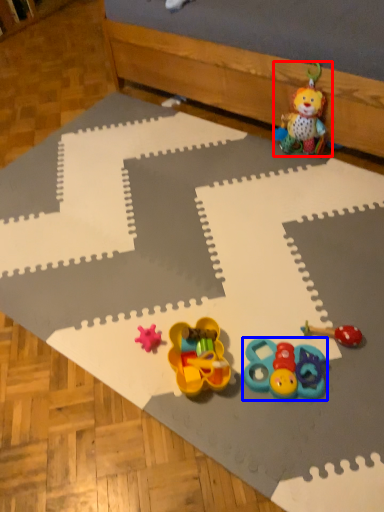
Question: Which object is closer to the camera taking this photo, toy (highlighted by a red box) or toy (highlighted by a blue box)?

Choices:
 (A) toy
 (B) toy

Answer: (B)